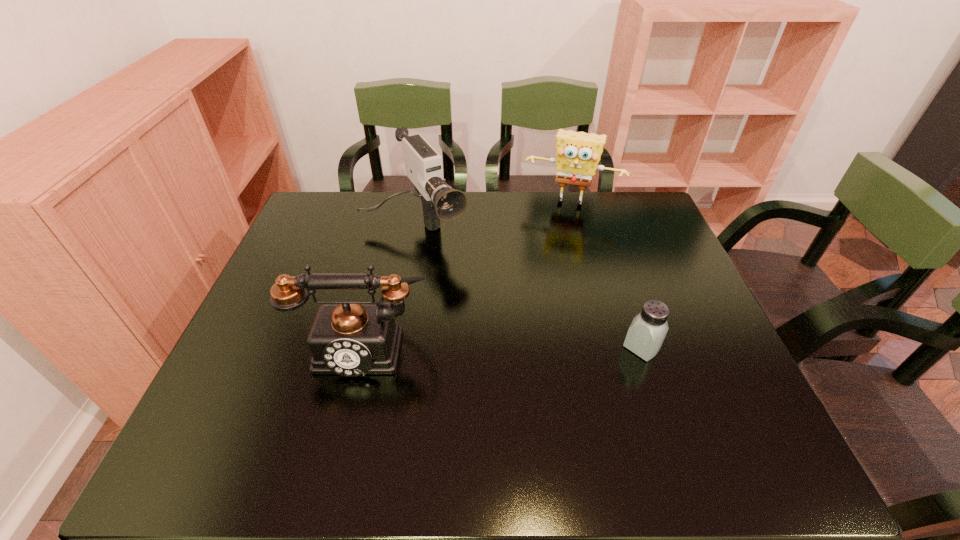
At what (x,y) coordinates should I click in order to perform the action: click on free space on the desktop that is between the telephone and the shortest object and is positioned on the recording direction of the camcorder. Please return your answer as a coordinate pair (x, y). Image resolution: width=960 pixels, height=540 pixels. Looking at the image, I should click on (496, 346).

Identify the location of free space on the desktop that is between the telephone and the shortest object and is positioned on the face of the sponge. (530, 346).